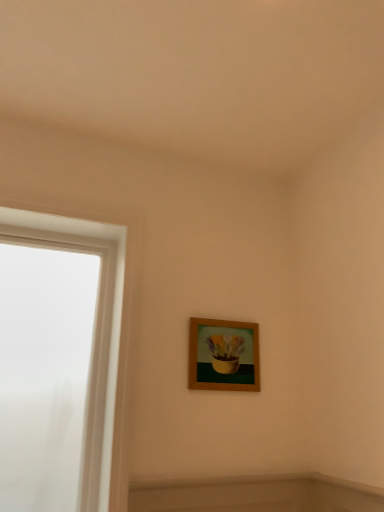
Question: Does white frosted glass at left come behind wooden frame at center?

Choices:
 (A) no
 (B) yes

Answer: (A)

Question: Can wooden frame at center be found inside white frosted glass at left?

Choices:
 (A) yes
 (B) no

Answer: (B)

Question: Does white frosted glass at left have a smaller size compared to wooden frame at center?

Choices:
 (A) yes
 (B) no

Answer: (B)

Question: Can you confirm if white frosted glass at left is thinner than wooden frame at center?

Choices:
 (A) yes
 (B) no

Answer: (B)

Question: Is white frosted glass at left shorter than wooden frame at center?

Choices:
 (A) yes
 (B) no

Answer: (B)

Question: Is white frosted glass at left outside wooden frame at center?

Choices:
 (A) yes
 (B) no

Answer: (A)

Question: Is wooden frame at center outside of white frosted glass at left?

Choices:
 (A) no
 (B) yes

Answer: (B)

Question: Considering the relative sizes of wooden frame at center and white frosted glass at left in the image provided, is wooden frame at center shorter than white frosted glass at left?

Choices:
 (A) no
 (B) yes

Answer: (B)

Question: Can you confirm if wooden frame at center is taller than white frosted glass at left?

Choices:
 (A) no
 (B) yes

Answer: (A)

Question: Is white frosted glass at left located within wooden frame at center?

Choices:
 (A) no
 (B) yes

Answer: (A)

Question: From a real-world perspective, is wooden frame at center under white frosted glass at left?

Choices:
 (A) yes
 (B) no

Answer: (B)

Question: Considering the relative sizes of wooden frame at center and white frosted glass at left in the image provided, is wooden frame at center smaller than white frosted glass at left?

Choices:
 (A) yes
 (B) no

Answer: (A)

Question: From a real-world perspective, is wooden frame at center above or below white frosted glass at left?

Choices:
 (A) above
 (B) below

Answer: (A)